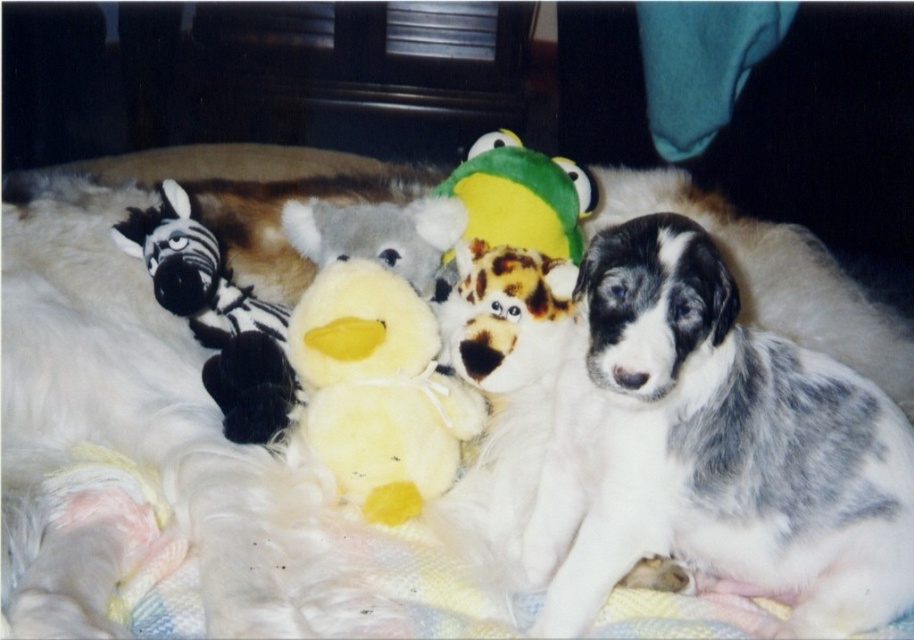
You are a child who wants to choose the wider toy between the fluffy plush dog at center and the green plush frog at center. Which one should you pick?

The green plush frog at center is wider than the fluffy plush dog at center, so you should pick the green plush frog at center.

You are standing in the room with the puppy and plush toys. You want to pick up the item that is closer to you. Which point should you reach for, point (x=485, y=404) or point (x=541, y=328)?

Point (x=485, y=404) is further to the viewer than point (x=541, y=328). Therefore, you should reach for point (x=541, y=328) as it is closer to you.

Please provide the 2D coordinates of the fluffy plush dog at center in the image. The coordinates should be in the format of a point with two decimal places, like this example format point format example point format example point format example point format example point format example point format example point format example point format example point format example point format example point format example point format example point format example point format example point format example point format.

The fluffy plush dog at center is located at point (503,314).